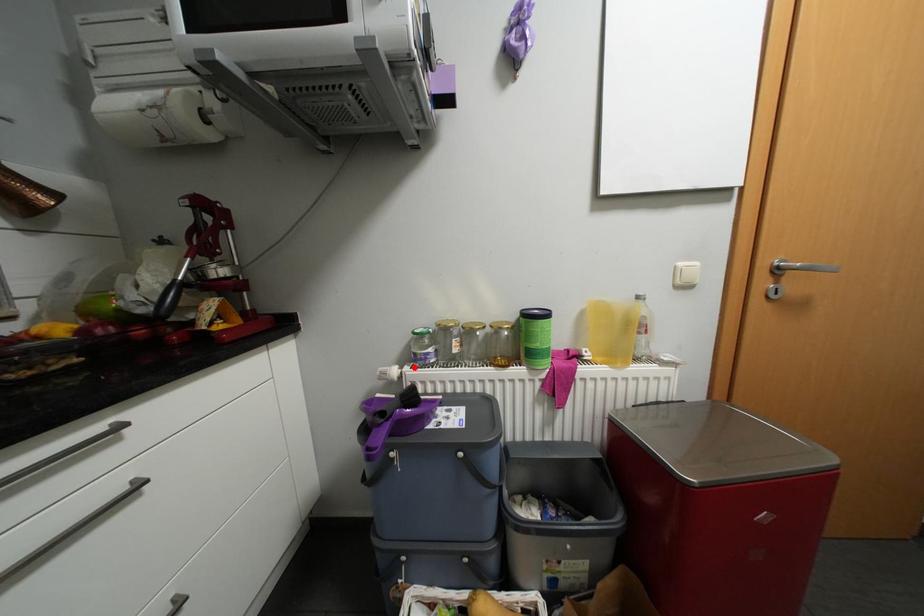
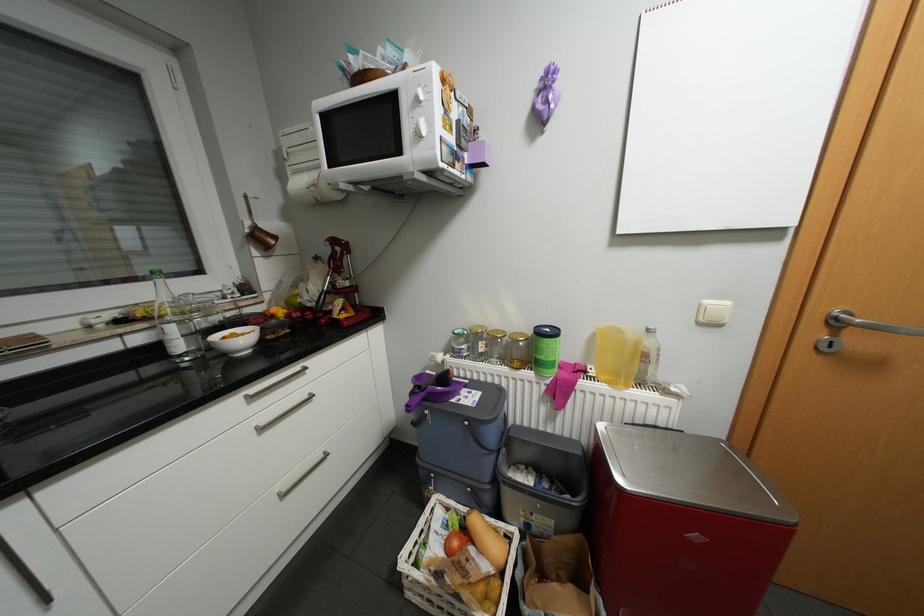
In the second image, find the point that corresponds to the highlighted location in the first image.

(456, 355)